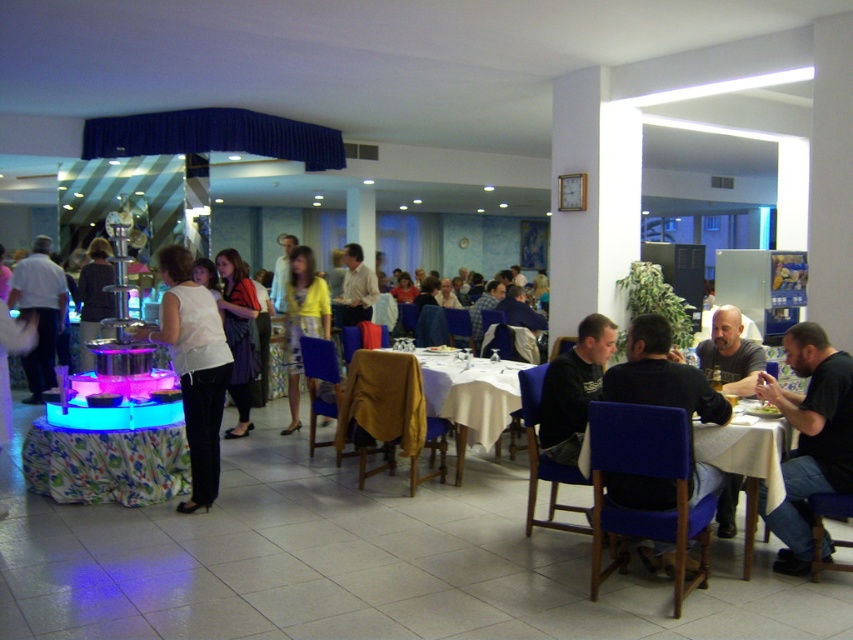
Question: Where is white fabric table at center located in relation to white fabric table at lower right in the image?

Choices:
 (A) below
 (B) above

Answer: (B)

Question: Among these objects, which one is farthest from the camera?

Choices:
 (A) black leather jacket at right
 (B) matte purple dress at center
 (C) matte white shirt at left

Answer: (C)

Question: Does black matte shirt at right have a larger size compared to white fabric table at lower right?

Choices:
 (A) no
 (B) yes

Answer: (A)

Question: Is the position of white fabric dress at center less distant than that of black matte shirt at lower right?

Choices:
 (A) no
 (B) yes

Answer: (A)

Question: Which point is closer to the camera?

Choices:
 (A) yellow fabric skirt at center
 (B) black matte shirt at right

Answer: (B)

Question: Estimate the real-world distances between objects in this image. Which object is farther from the white fabric dress at center?

Choices:
 (A) black matte shirt at right
 (B) yellow fabric skirt at center

Answer: (A)